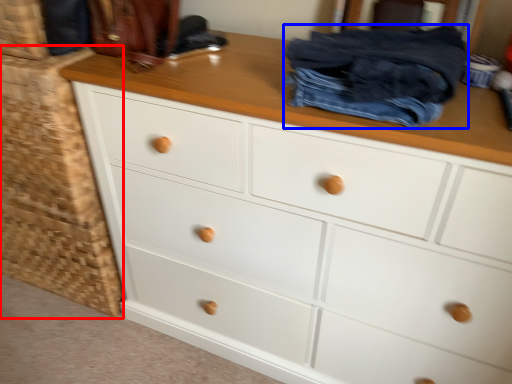
Question: Which point is closer to the camera, cabinetry (highlighted by a red box) or clothing (highlighted by a blue box)?

Choices:
 (A) cabinetry
 (B) clothing

Answer: (B)